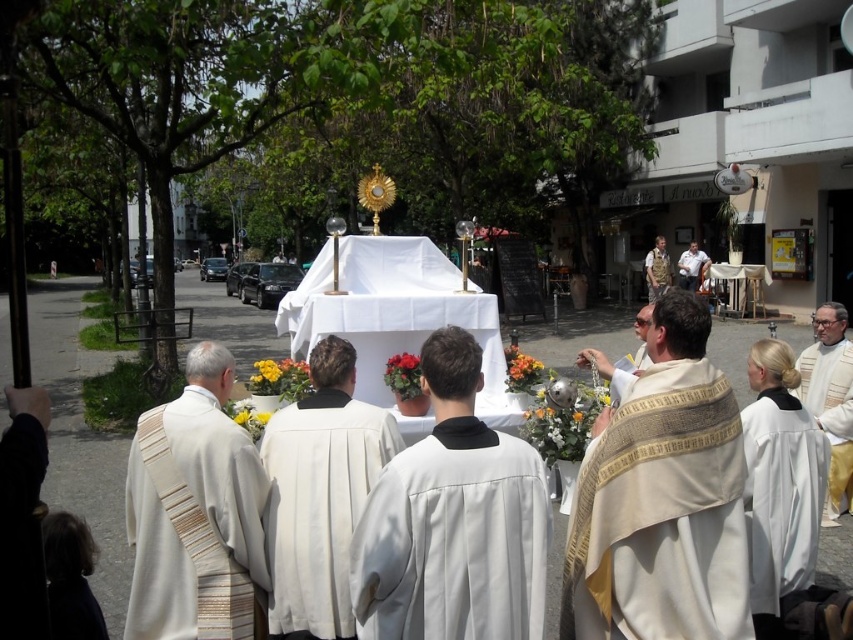
Does white textured sash at center appear on the left side of smooth red rose at center?

Yes, white textured sash at center is to the left of smooth red rose at center.

Who is more distant from viewer, [165,465] or [401,353]?

The point [401,353] is more distant.

I want to click on white textured sash at center, so click(196, 515).

Can you confirm if beige textured robe at center is positioned to the left of smooth red rose at center?

No, beige textured robe at center is not to the left of smooth red rose at center.

Which is above, beige textured robe at center or smooth red rose at center?

Positioned higher is beige textured robe at center.

This screenshot has height=640, width=853. What are the coordinates of `beige textured robe at center` in the screenshot? It's located at (621, 362).

This screenshot has width=853, height=640. I want to click on beige textured robe at center, so [621, 362].

Is white textured robe at center bigger than vibrant orange petals at center?

Indeed, white textured robe at center has a larger size compared to vibrant orange petals at center.

Can you confirm if white textured robe at center is positioned above vibrant orange petals at center?

No.

Does point (572, 520) come behind point (541, 374)?

No.

Identify the location of white textured robe at center. Image resolution: width=853 pixels, height=640 pixels. (662, 500).